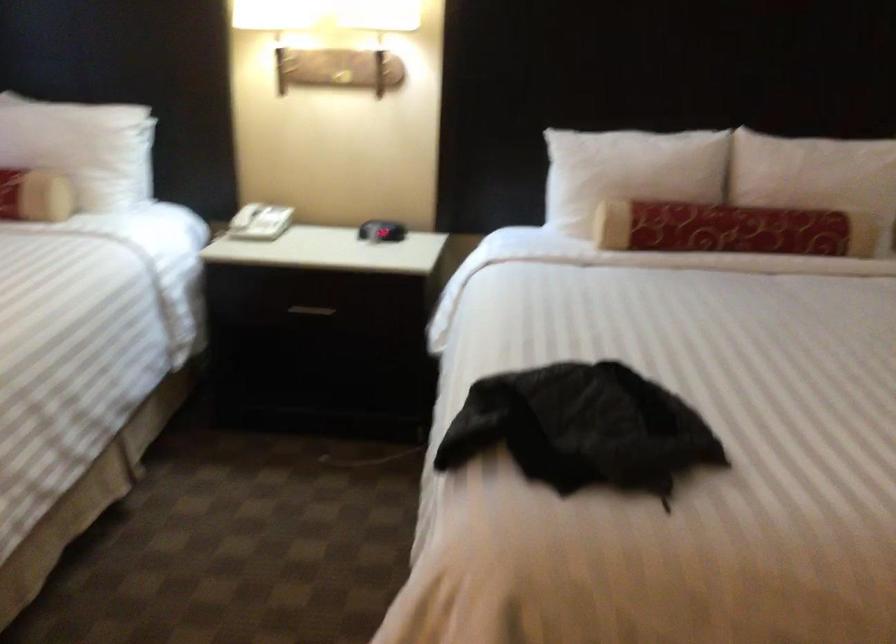
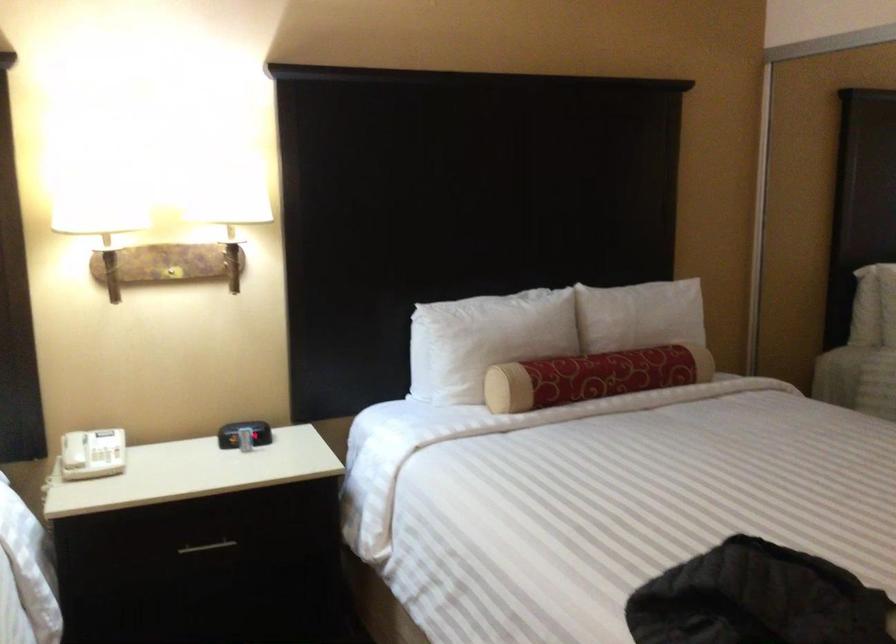
The point at (340,76) is marked in the first image. Where is the corresponding point in the second image?

(171, 272)